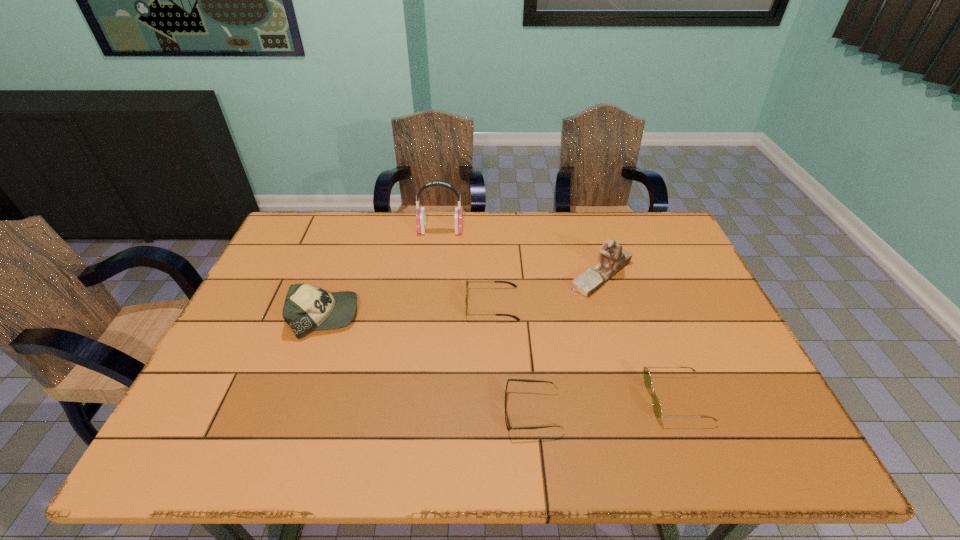
You are a GUI agent. You are given a task and a screenshot of the screen. Output one action in this format:
    pyautogui.click(x=<x>, y=<y>)
    Task: Click on the earphone
    Image resolution: width=960 pixels, height=540 pixels.
    Given the screenshot: What is the action you would take?
    pyautogui.click(x=420, y=217)

Locate an element on the screen. The width and height of the screenshot is (960, 540). the tallest object is located at coordinates (420, 217).

Where is `figurine`? This screenshot has height=540, width=960. figurine is located at coordinates (612, 259).

The height and width of the screenshot is (540, 960). Find the location of `the third tallest object`. the third tallest object is located at coordinates (307, 308).

You are a GUI agent. You are given a task and a screenshot of the screen. Output one action in this format:
    pyautogui.click(x=<x>, y=<y>)
    Task: Click on the leftmost object
    
    Given the screenshot: What is the action you would take?
    pyautogui.click(x=307, y=308)

Locate an element on the screen. the farthest sunglasses is located at coordinates (466, 299).

Locate an element on the screen. the rightmost sunglasses is located at coordinates (657, 409).

Where is `the shortest sunglasses`? The width and height of the screenshot is (960, 540). the shortest sunglasses is located at coordinates (509, 427).

Image resolution: width=960 pixels, height=540 pixels. I want to click on free location located on the outer surface of the fifth object from right to left, so click(554, 230).

Identify the location of vacant space located 0.130m on the front-facing side of the figurine. The image size is (960, 540). (523, 275).